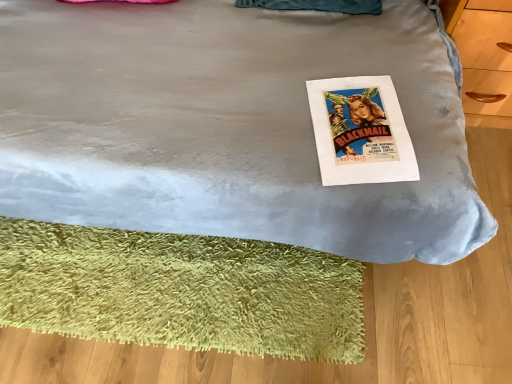
Question: From the image's perspective, would you say velvet blue bed at center is positioned over white paper at center?

Choices:
 (A) no
 (B) yes

Answer: (B)

Question: Is velvet blue bed at center smaller than white paper at center?

Choices:
 (A) yes
 (B) no

Answer: (B)

Question: Is velvet blue bed at center positioned with its back to white paper at center?

Choices:
 (A) yes
 (B) no

Answer: (B)

Question: Does velvet blue bed at center turn towards white paper at center?

Choices:
 (A) no
 (B) yes

Answer: (B)

Question: Is velvet blue bed at center at the left side of white paper at center?

Choices:
 (A) no
 (B) yes

Answer: (B)

Question: From the image's perspective, is white paper at center located above or below velvet blue bed at center?

Choices:
 (A) below
 (B) above

Answer: (A)

Question: Would you say white paper at center is inside or outside velvet blue bed at center?

Choices:
 (A) inside
 (B) outside

Answer: (A)

Question: Considering the relative positions of white paper at center and velvet blue bed at center in the image provided, is white paper at center to the left or to the right of velvet blue bed at center?

Choices:
 (A) right
 (B) left

Answer: (A)

Question: Relative to velvet blue bed at center, is white paper at center in front or behind?

Choices:
 (A) behind
 (B) front

Answer: (A)

Question: From the image's perspective, is green shaggy mat at lower left above or below white paper at center?

Choices:
 (A) below
 (B) above

Answer: (A)

Question: Considering the positions of green shaggy mat at lower left and white paper at center in the image, is green shaggy mat at lower left taller or shorter than white paper at center?

Choices:
 (A) tall
 (B) short

Answer: (A)

Question: Would you say green shaggy mat at lower left is to the left or to the right of white paper at center in the picture?

Choices:
 (A) left
 (B) right

Answer: (A)

Question: Does point (150, 329) appear closer or farther from the camera than point (314, 97)?

Choices:
 (A) farther
 (B) closer

Answer: (A)

Question: From their relative heights in the image, would you say velvet blue bed at center is taller or shorter than green shaggy mat at lower left?

Choices:
 (A) short
 (B) tall

Answer: (B)

Question: Is velvet blue bed at center inside or outside of green shaggy mat at lower left?

Choices:
 (A) outside
 (B) inside

Answer: (A)